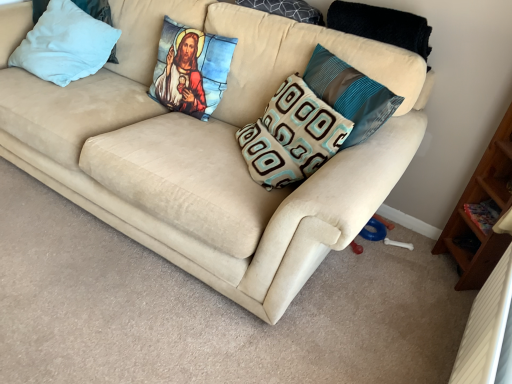
The image size is (512, 384). In order to click on brown and light blue patterned pillow at center, placed as the third pillow when sorted from left to right in this screenshot , I will do `click(292, 136)`.

Describe the element at coordinates (212, 151) in the screenshot. I see `suede beige couch at center` at that location.

In order to face suede beige couch at center, should I rotate leftwards or rightwards?

Turn left approximately 13.646 degrees to face it.

What do you see at coordinates (65, 44) in the screenshot? This screenshot has height=384, width=512. I see `light blue fabric pillow at upper left, the fifth pillow in the right-to-left sequence` at bounding box center [65, 44].

What is the approximate width of teal-patterned cushion at center-right, the fifth pillow positioned from the left?

The width of teal-patterned cushion at center-right, the fifth pillow positioned from the left, is 7.43 inches.

Identify the location of brown and light blue patterned pillow at center, placed as the third pillow when sorted from left to right. (292, 136).

Is suede beige couch at center to the right of stained glass pillow at upper center, the second pillow viewed from the left, from the viewer's perspective?

No.

Locate an element on the screen. the 3rd pillow behind when counting from the suede beige couch at center is located at coordinates (191, 70).

Who is bigger, suede beige couch at center or stained glass pillow at upper center, marked as the fourth pillow in a right-to-left arrangement?

Bigger between the two is suede beige couch at center.

Is suede beige couch at center far from stained glass pillow at upper center, the second pillow viewed from the left?

No, there isn't a large distance between suede beige couch at center and stained glass pillow at upper center, the second pillow viewed from the left.

Locate an element on the screen. The image size is (512, 384). the 2nd pillow in front of the stained glass pillow at upper center, marked as the fourth pillow in a right-to-left arrangement is located at coordinates (350, 94).

From a real-world perspective, between stained glass pillow at upper center, marked as the fourth pillow in a right-to-left arrangement, and teal-patterned cushion at center-right, the 1th pillow from the right, who is vertically lower?

From a 3D spatial view, stained glass pillow at upper center, marked as the fourth pillow in a right-to-left arrangement, is below.

Is stained glass pillow at upper center, marked as the fourth pillow in a right-to-left arrangement, surrounding teal-patterned cushion at center-right, the 1th pillow from the right?

No, teal-patterned cushion at center-right, the 1th pillow from the right, is not a part of stained glass pillow at upper center, marked as the fourth pillow in a right-to-left arrangement.

Would you say stained glass pillow at upper center, marked as the fourth pillow in a right-to-left arrangement, is to the left or to the right of teal-patterned cushion at center-right, the fifth pillow positioned from the left, in the picture?

stained glass pillow at upper center, marked as the fourth pillow in a right-to-left arrangement, is positioned on teal-patterned cushion at center-right, the fifth pillow positioned from the left,'s left side.

What are the coordinates of `studio couch that appears above the teal-patterned cushion at center-right, the fifth pillow positioned from the left (from the image's perspective)` in the screenshot? It's located at (212, 151).

Does suede beige couch at center lie in front of teal-patterned cushion at center-right, the fifth pillow positioned from the left?

Yes, suede beige couch at center is closer to the viewer.

Does point (80, 171) lie behind point (324, 76)?

That is True.

Does suede beige couch at center appear on the left side of teal-patterned cushion at center-right, the 1th pillow from the right?

Yes.

Is light blue fabric pillow at upper left, the fifth pillow in the right-to-left sequence, to the left of brown and light blue patterned pillow at center, marked as the third pillow in a right-to-left arrangement, from the viewer's perspective?

Yes, light blue fabric pillow at upper left, the fifth pillow in the right-to-left sequence, is to the left of brown and light blue patterned pillow at center, marked as the third pillow in a right-to-left arrangement.

Identify the location of the 1st pillow located above the light blue fabric pillow at upper left, which is the 1th pillow in left-to-right order (from a real-world perspective). The width and height of the screenshot is (512, 384). (292, 136).

Is dark gray textured pillow at upper center, which is counted as the 4th pillow, starting from the left, closer to camera compared to suede beige couch at center?

No, it is not.

You are a GUI agent. You are given a task and a screenshot of the screen. Output one action in this format:
    pyautogui.click(x=<x>, y=<y>)
    Task: Click on the studio couch on the left of dark gray textured pillow at upper center, which is counted as the 4th pillow, starting from the left
    The image size is (512, 384).
    Given the screenshot: What is the action you would take?
    click(x=212, y=151)

Is dark gray textured pillow at upper center, arranged as the 2th pillow when viewed from the right, to the left or to the right of suede beige couch at center in the image?

dark gray textured pillow at upper center, arranged as the 2th pillow when viewed from the right, is to the right of suede beige couch at center.

Based on the photo, from the image's perspective, is dark gray textured pillow at upper center, arranged as the 2th pillow when viewed from the right, located above suede beige couch at center?

Correct, dark gray textured pillow at upper center, arranged as the 2th pillow when viewed from the right, appears higher than suede beige couch at center in the image.

From the image's perspective, is stained glass pillow at upper center, the second pillow viewed from the left, above or below light blue fabric pillow at upper left, which is the 1th pillow in left-to-right order?

Based on their image positions, stained glass pillow at upper center, the second pillow viewed from the left, is located beneath light blue fabric pillow at upper left, which is the 1th pillow in left-to-right order.

Considering their positions, is stained glass pillow at upper center, marked as the fourth pillow in a right-to-left arrangement, located in front of or behind light blue fabric pillow at upper left, which is the 1th pillow in left-to-right order?

Visually, stained glass pillow at upper center, marked as the fourth pillow in a right-to-left arrangement, is located in front of light blue fabric pillow at upper left, which is the 1th pillow in left-to-right order.

From a real-world perspective, who is located lower, stained glass pillow at upper center, the second pillow viewed from the left, or light blue fabric pillow at upper left, the fifth pillow in the right-to-left sequence?

light blue fabric pillow at upper left, the fifth pillow in the right-to-left sequence.

Measure the distance between stained glass pillow at upper center, the second pillow viewed from the left, and light blue fabric pillow at upper left, which is the 1th pillow in left-to-right order.

They are 19.66 inches apart.

Does suede beige couch at center have a larger size compared to light blue fabric pillow at upper left, which is the 1th pillow in left-to-right order?

Yes, suede beige couch at center is bigger than light blue fabric pillow at upper left, which is the 1th pillow in left-to-right order.

Would you consider suede beige couch at center to be distant from light blue fabric pillow at upper left, the fifth pillow in the right-to-left sequence?

suede beige couch at center is near light blue fabric pillow at upper left, the fifth pillow in the right-to-left sequence, not far away.

Which object is closer to the camera taking this photo, suede beige couch at center or light blue fabric pillow at upper left, which is the 1th pillow in left-to-right order?

Positioned in front is suede beige couch at center.

Identify the location of studio couch on the left of stained glass pillow at upper center, marked as the fourth pillow in a right-to-left arrangement. (212, 151).

The width and height of the screenshot is (512, 384). I want to click on the 1st pillow above the teal-patterned cushion at center-right, the 1th pillow from the right (from the image's perspective), so click(191, 70).

When comparing their distances from light blue fabric pillow at upper left, which is the 1th pillow in left-to-right order, does dark gray textured pillow at upper center, which is counted as the 4th pillow, starting from the left, or teal-patterned cushion at center-right, the fifth pillow positioned from the left, seem further?

teal-patterned cushion at center-right, the fifth pillow positioned from the left.

Considering their positions, is brown and light blue patterned pillow at center, marked as the third pillow in a right-to-left arrangement, positioned closer to suede beige couch at center than teal-patterned cushion at center-right, the 1th pillow from the right?

brown and light blue patterned pillow at center, marked as the third pillow in a right-to-left arrangement, is closer to suede beige couch at center.

Which object lies nearer to the anchor point stained glass pillow at upper center, the second pillow viewed from the left, suede beige couch at center or light blue fabric pillow at upper left, the fifth pillow in the right-to-left sequence?

Based on the image, suede beige couch at center appears to be nearer to stained glass pillow at upper center, the second pillow viewed from the left.

From the image, which object appears to be nearer to light blue fabric pillow at upper left, the fifth pillow in the right-to-left sequence, suede beige couch at center or stained glass pillow at upper center, the second pillow viewed from the left?

Based on the image, suede beige couch at center appears to be nearer to light blue fabric pillow at upper left, the fifth pillow in the right-to-left sequence.

Considering their positions, is suede beige couch at center positioned closer to light blue fabric pillow at upper left, the fifth pillow in the right-to-left sequence, than teal-patterned cushion at center-right, the 1th pillow from the right?

suede beige couch at center lies closer to light blue fabric pillow at upper left, the fifth pillow in the right-to-left sequence, than the other object.

Which object lies further to the anchor point stained glass pillow at upper center, the second pillow viewed from the left, suede beige couch at center or dark gray textured pillow at upper center, arranged as the 2th pillow when viewed from the right?

dark gray textured pillow at upper center, arranged as the 2th pillow when viewed from the right.

Estimate the real-world distances between objects in this image. Which object is further from dark gray textured pillow at upper center, which is counted as the 4th pillow, starting from the left, stained glass pillow at upper center, the second pillow viewed from the left, or brown and light blue patterned pillow at center, marked as the third pillow in a right-to-left arrangement?

Based on the image, brown and light blue patterned pillow at center, marked as the third pillow in a right-to-left arrangement, appears to be further to dark gray textured pillow at upper center, which is counted as the 4th pillow, starting from the left.

When comparing their distances from dark gray textured pillow at upper center, arranged as the 2th pillow when viewed from the right, does light blue fabric pillow at upper left, which is the 1th pillow in left-to-right order, or teal-patterned cushion at center-right, the fifth pillow positioned from the left, seem further?

Among the two, light blue fabric pillow at upper left, which is the 1th pillow in left-to-right order, is located further to dark gray textured pillow at upper center, arranged as the 2th pillow when viewed from the right.

This screenshot has height=384, width=512. I want to click on pillow located between light blue fabric pillow at upper left, the fifth pillow in the right-to-left sequence, and brown and light blue patterned pillow at center, marked as the third pillow in a right-to-left arrangement, in the left-right direction, so click(191, 70).

This screenshot has width=512, height=384. I want to click on studio couch situated between light blue fabric pillow at upper left, the fifth pillow in the right-to-left sequence, and teal-patterned cushion at center-right, the fifth pillow positioned from the left, from left to right, so click(x=212, y=151).

Where is `studio couch between light blue fabric pillow at upper left, which is the 1th pillow in left-to-right order, and brown and light blue patterned pillow at center, marked as the third pillow in a right-to-left arrangement, from left to right`? studio couch between light blue fabric pillow at upper left, which is the 1th pillow in left-to-right order, and brown and light blue patterned pillow at center, marked as the third pillow in a right-to-left arrangement, from left to right is located at coordinates (212, 151).

Image resolution: width=512 pixels, height=384 pixels. I want to click on studio couch between light blue fabric pillow at upper left, which is the 1th pillow in left-to-right order, and dark gray textured pillow at upper center, arranged as the 2th pillow when viewed from the right, so click(x=212, y=151).